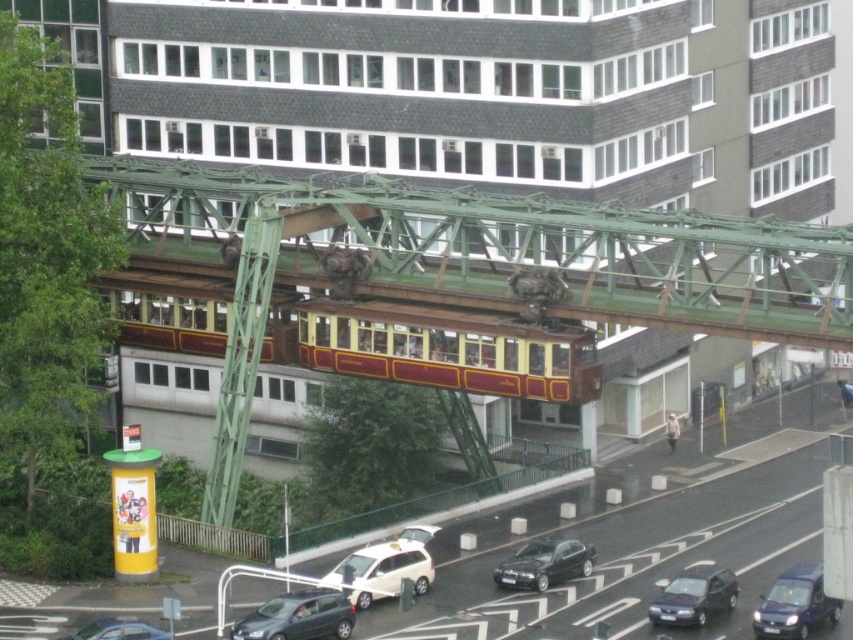
You are a delivery driver trying to park your 1.8 meters wide van in the space between the shiny black car at lower center and the metallic gray car at lower left. Can you fit your van in that space?

The shiny black car at lower center might be wider than metallic gray car at lower left, so the space between them may not be wide enough for your 1.8 meters wide van. It is uncertain and you should check the actual width before attempting to park.

You are a delivery driver trying to park your truck in a narrow alley. You see a white matte van at lower center and a shiny black car at lower center parked below the tram. Which vehicle takes up more space on the street?

The white matte van at lower center takes up more space on the street because its width surpasses that of the shiny black car at lower center.

You are standing on the sidewalk and see the metallic blue van at lower right. Where is it positioned relative to the tramway?

The metallic blue van at lower right is located at point (795, 604), which places it below and to the right of the tramway.